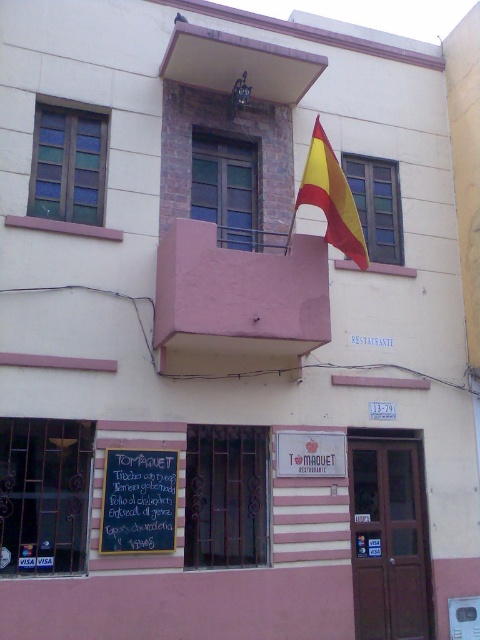
Is black chalkboard at center in front of yellowmaterial/textureflag at upper center?

Yes, black chalkboard at center is closer to the viewer.

Is black chalkboard at center shorter than yellowmaterial/textureflag at upper center?

Indeed, black chalkboard at center has a lesser height compared to yellowmaterial/textureflag at upper center.

Where is `black chalkboard at center`? The image size is (480, 640). black chalkboard at center is located at coordinates (139, 500).

The height and width of the screenshot is (640, 480). Find the location of `black chalkboard at center`. black chalkboard at center is located at coordinates (139, 500).